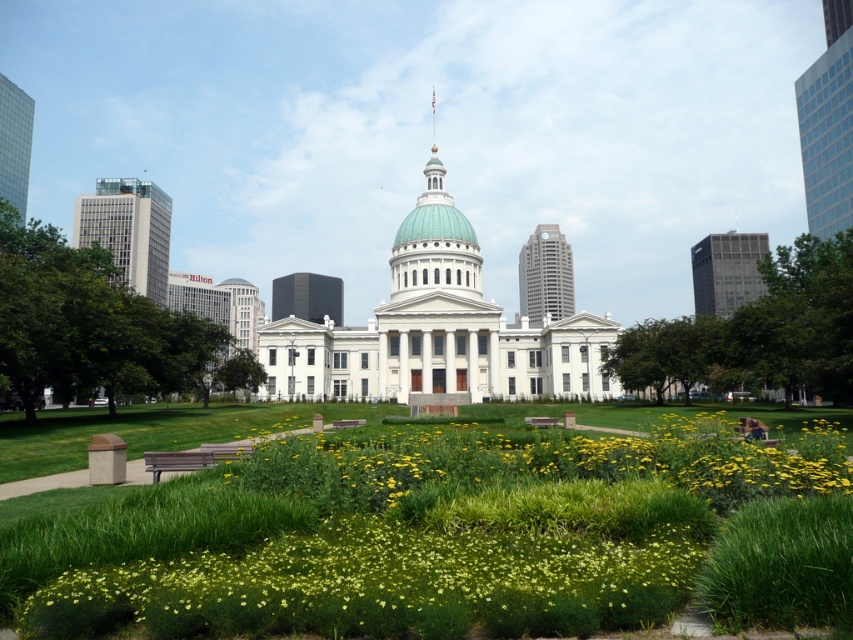
Is wooden park bench at lower left to the right of brown wooden park bench at center from the viewer's perspective?

No, wooden park bench at lower left is not to the right of brown wooden park bench at center.

Does wooden park bench at lower left have a smaller size compared to brown wooden park bench at center?

Incorrect, wooden park bench at lower left is not smaller in size than brown wooden park bench at center.

Which is behind, point (213, 448) or point (543, 424)?

The point (543, 424) is more distant.

Identify the location of wooden park bench at lower left. The height and width of the screenshot is (640, 853). (194, 458).

Measure the distance between green grass at center and camera.

green grass at center and camera are 42.27 meters apart from each other.

This screenshot has height=640, width=853. What are the coordinates of `green grass at center` in the screenshot? It's located at (453, 538).

Is brown wooden park bench at center bigger than wooden park bench at center?

Yes, brown wooden park bench at center is bigger than wooden park bench at center.

Between point (556, 424) and point (363, 420), which one is positioned in front?

Positioned in front is point (556, 424).

At what (x,y) coordinates should I click in order to perform the action: click on brown wooden park bench at center. Please return your answer as a coordinate pair (x, y). Looking at the image, I should click on (543, 420).